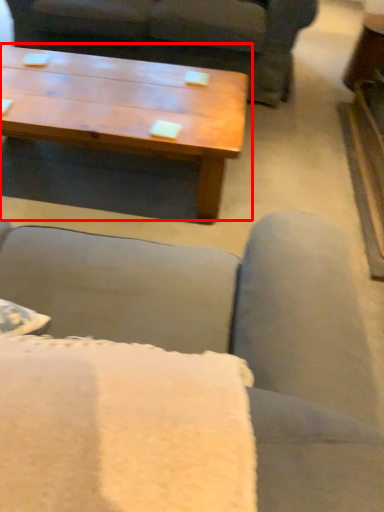
Question: Observing the image, what is the correct spatial positioning of coffee table (annotated by the red box) in reference to studio couch?

Choices:
 (A) left
 (B) right

Answer: (A)